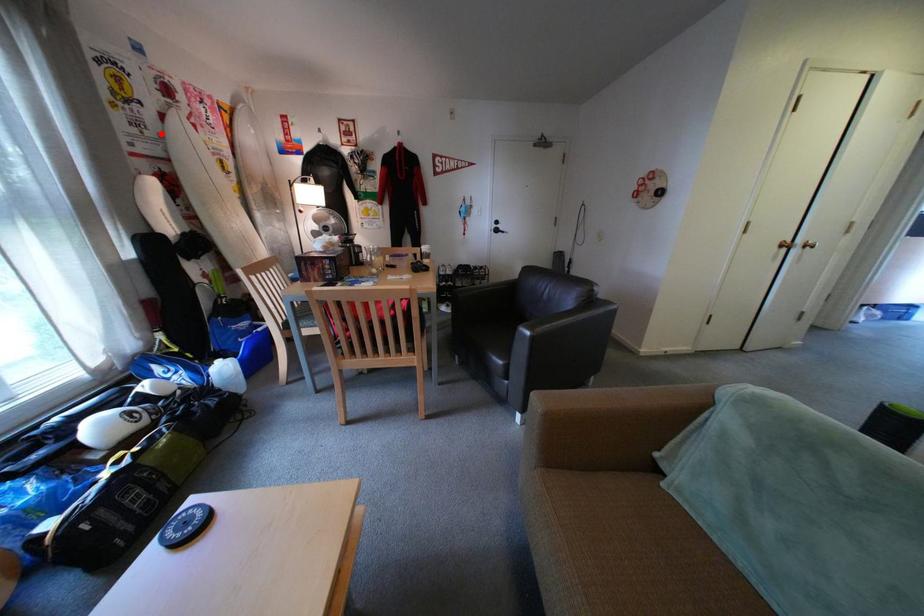
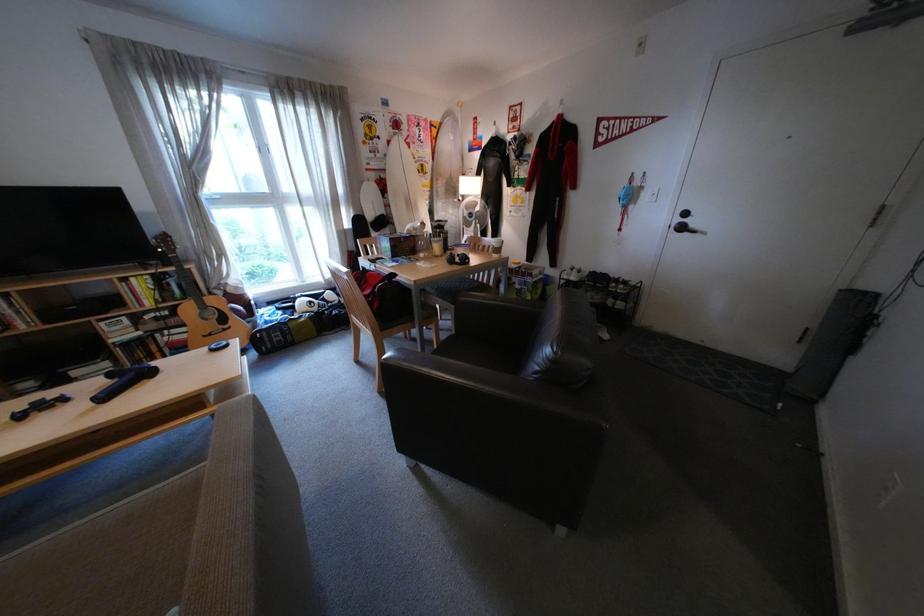
Locate, in the second image, the point that corresponds to the highlighted location in the first image.

(392, 156)